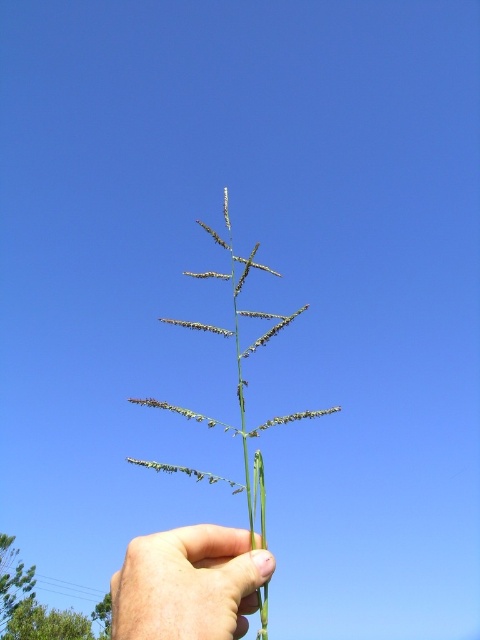
You are a botanist examining a plant specimen. You observe the skinny green stem at center and the green grass at center. Which part of the plant takes up more area in the image?

The green grass at center takes up more area than the skinny green stem at center because the skinny green stem at center occupies less space than green grass at center.

From the picture: You are a botanist examining a plant sample. You notice two parts labeled as skinny green stem at center and green grass at center. Which part has a greater width?

The skinny green stem at center has a greater width than the green grass at center.

You are a botanist examining the plant in the image. Which part of the plant, the skinny green stem at center or the green grass at center, is closer to your eyes?

The skinny green stem at center is closer to your eyes because it is in front of the green grass at center.